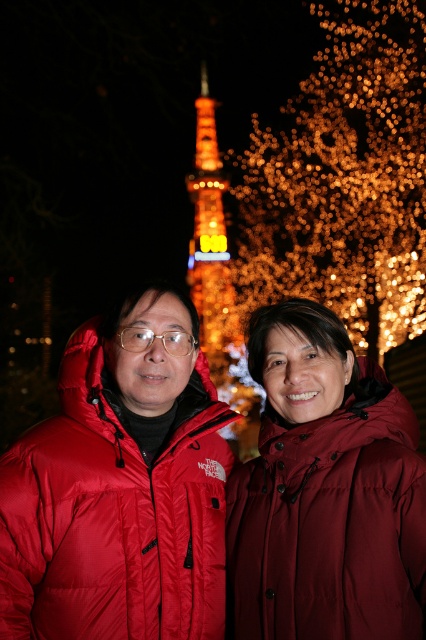
Question: Does illuminated golden lights at upper center appear under illuminated glass tower at center?

Choices:
 (A) no
 (B) yes

Answer: (A)

Question: Is burgundy matte jacket at center smaller than illuminated golden lights at upper center?

Choices:
 (A) yes
 (B) no

Answer: (A)

Question: Which object is closer to the camera taking this photo?

Choices:
 (A) illuminated glass tower at center
 (B) illuminated golden lights at upper center
 (C) burgundy matte jacket at center

Answer: (C)

Question: Which object is the closest to the burgundy matte jacket at center?

Choices:
 (A) illuminated glass tower at center
 (B) matte red puffer jacket at center

Answer: (B)

Question: Can you confirm if burgundy matte jacket at center is bigger than matte red puffer jacket at center?

Choices:
 (A) no
 (B) yes

Answer: (A)

Question: Which is nearer to the illuminated glass tower at center?

Choices:
 (A) illuminated golden lights at upper center
 (B) matte red puffer jacket at center
 (C) burgundy matte jacket at center

Answer: (A)